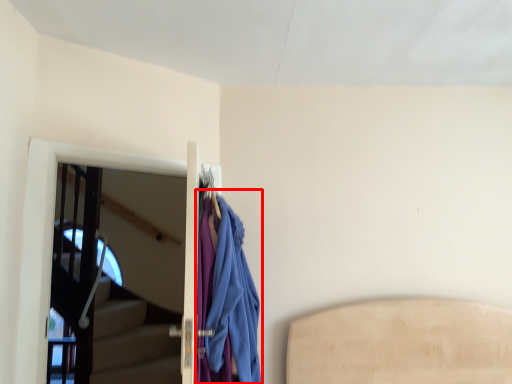
Question: Observing the image, what is the correct spatial positioning of cloak (annotated by the red box) in reference to screen door?

Choices:
 (A) right
 (B) left

Answer: (A)